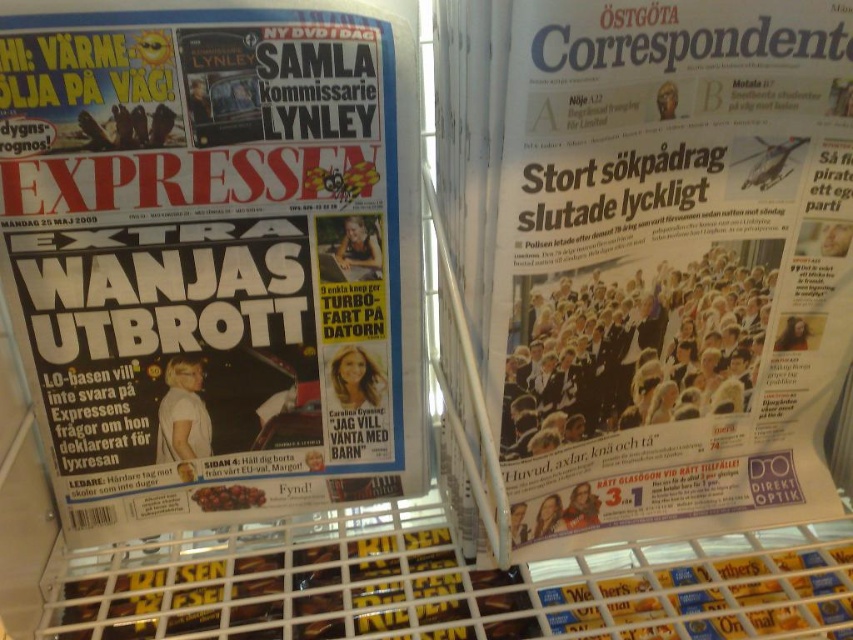
Question: Where is matte black newspaper at center located in relation to white glossy paper at upper center in the image?

Choices:
 (A) right
 (B) left

Answer: (B)

Question: Which object is farther from the camera taking this photo?

Choices:
 (A) white glossy paper at upper center
 (B) matte black newspaper at center

Answer: (B)

Question: Does matte black newspaper at center have a lesser width compared to white glossy paper at upper center?

Choices:
 (A) yes
 (B) no

Answer: (A)

Question: Can you confirm if matte black newspaper at center is positioned above white glossy paper at upper center?

Choices:
 (A) yes
 (B) no

Answer: (A)